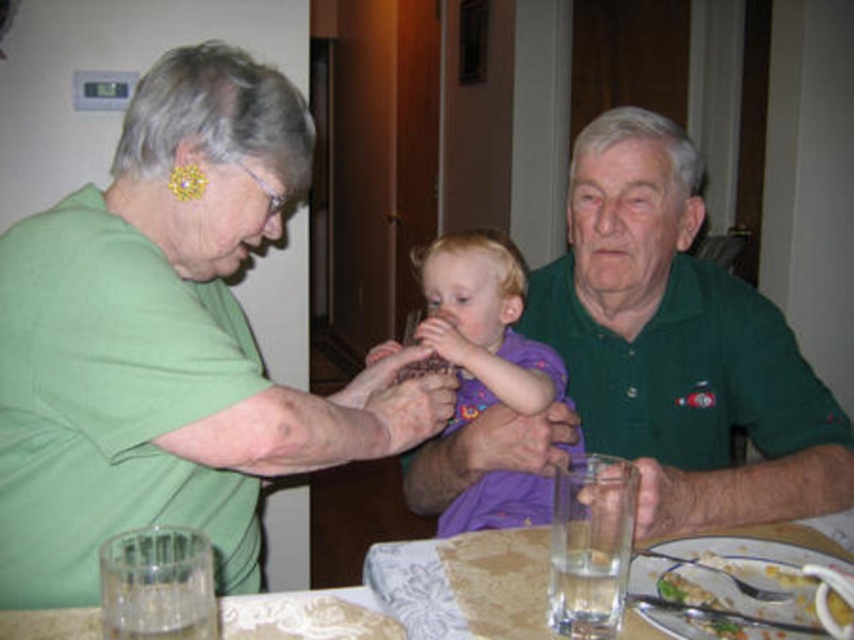
Can you confirm if green matte shirt at upper left is positioned to the right of yellowish plastic plate at lower right?

In fact, green matte shirt at upper left is to the left of yellowish plastic plate at lower right.

Between point (313, 138) and point (650, 563), which one is positioned behind?

The point (313, 138) is behind.

Between point (188, 250) and point (825, 557), which one is positioned behind?

The point (188, 250) is behind.

Find the location of a particular element. The height and width of the screenshot is (640, 854). green matte shirt at upper left is located at coordinates (168, 340).

Is green cotton shirt at center smaller than yellowish plastic plate at lower right?

No, green cotton shirt at center is not smaller than yellowish plastic plate at lower right.

Does point (740, 419) lie in front of point (763, 637)?

No.

Is point (674, 476) positioned in front of point (718, 566)?

No, it is behind (718, 566).

This screenshot has height=640, width=854. Identify the location of green cotton shirt at center. (657, 356).

Does purple soft fabric baby at center have a greater width compared to clear glass water at lower center?

Yes.

Can you confirm if purple soft fabric baby at center is thinner than clear glass water at lower center?

In fact, purple soft fabric baby at center might be wider than clear glass water at lower center.

Between point (525, 484) and point (850, 531), which one is positioned in front?

Positioned in front is point (850, 531).

You are a GUI agent. You are given a task and a screenshot of the screen. Output one action in this format:
    pyautogui.click(x=<x>, y=<y>)
    Task: Click on the purple soft fabric baby at center
    
    Given the screenshot: What is the action you would take?
    pyautogui.click(x=483, y=324)